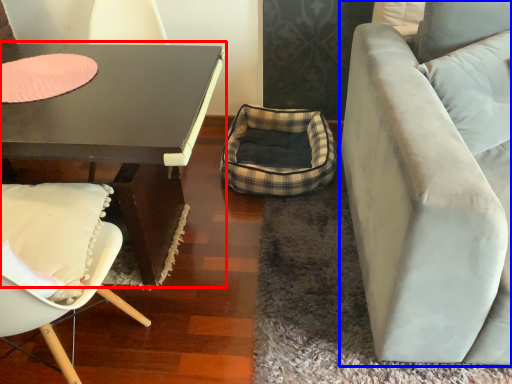
Question: Which object appears closest to the camera in this image, coffee table (highlighted by a red box) or studio couch (highlighted by a blue box)?

Choices:
 (A) coffee table
 (B) studio couch

Answer: (B)